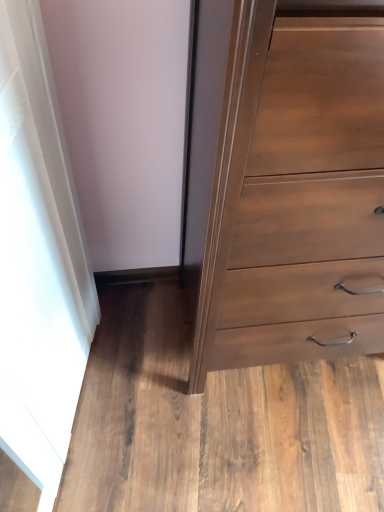
The image size is (384, 512). I want to click on free point in front of shiny brown wood chest of drawers at right, so click(271, 443).